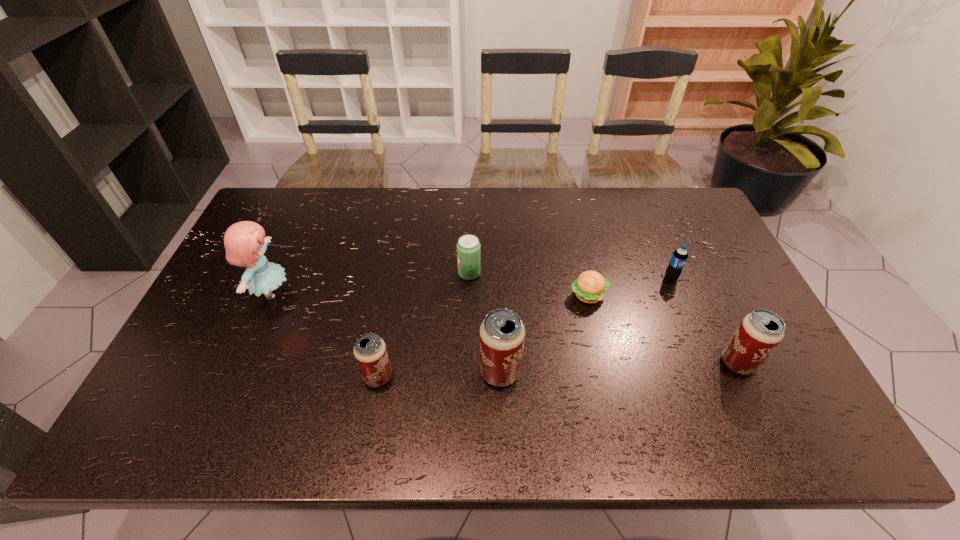
This screenshot has height=540, width=960. Identify the location of vacant point located between the left soda and the sixth object from left to right. (570, 276).

This screenshot has height=540, width=960. I want to click on free space between the second beer can from left to right and the doll, so click(386, 332).

Find the location of a particular element. The width and height of the screenshot is (960, 540). vacant space in between the rightmost beer can and the second object from right to left is located at coordinates (705, 321).

Locate an element on the screen. The height and width of the screenshot is (540, 960). free space between the second beer can from right to left and the second object from left to right is located at coordinates (439, 375).

Where is `free space between the second beer can from left to right and the third object from right to left`? free space between the second beer can from left to right and the third object from right to left is located at coordinates (544, 334).

Where is `free space between the leftmost beer can and the rightmost object`? Image resolution: width=960 pixels, height=540 pixels. free space between the leftmost beer can and the rightmost object is located at coordinates (558, 370).

You are a GUI agent. You are given a task and a screenshot of the screen. Output one action in this format:
    pyautogui.click(x=<x>, y=<y>)
    Task: Click on the free space between the second beer can from left to right and the fifth object from left to right
    The image size is (960, 540).
    Given the screenshot: What is the action you would take?
    pyautogui.click(x=544, y=334)

Find the location of a particular element. vacant space that's between the leftmost object and the leftmost beer can is located at coordinates (324, 335).

Point out which object is positioned as the third nearest to the second shortest beer can. Please provide its 2D coordinates. Your answer should be formatted as a tuple, i.e. [(x, y)], where the tuple contains the x and y coordinates of a point satisfying the conditions above.

[(502, 334)]

At what (x,y) coordinates should I click in order to perform the action: click on object that can be found as the third closest to the shortest beer can. Please return your answer as a coordinate pair (x, y). The width and height of the screenshot is (960, 540). Looking at the image, I should click on (468, 247).